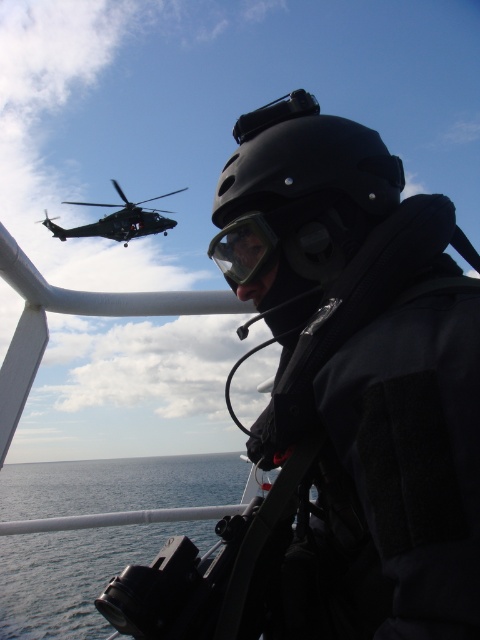
Question: Which is farther from the black matte helmet at center?

Choices:
 (A) transparent plastic goggles at center
 (B) dark gray matte helicopter at upper left

Answer: (B)

Question: Considering the relative positions of black matte helmet at center and transparent plastic goggles at center in the image provided, where is black matte helmet at center located with respect to transparent plastic goggles at center?

Choices:
 (A) below
 (B) above

Answer: (B)

Question: Does transparent plastic goggles at center appear under dark gray matte helicopter at upper left?

Choices:
 (A) no
 (B) yes

Answer: (B)

Question: In this image, where is black matte helmet at center located relative to transparent plastic goggles at center?

Choices:
 (A) left
 (B) right

Answer: (B)

Question: Which object is the closest to the black matte helmet at center?

Choices:
 (A) transparent plastic goggles at center
 (B) dark gray matte helicopter at upper left

Answer: (A)

Question: Which point is farther to the camera?

Choices:
 (A) (136, 225)
 (B) (365, 168)
 (C) (235, 262)

Answer: (A)